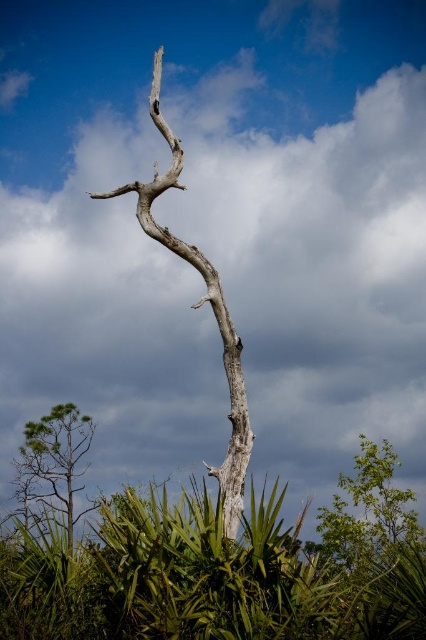
You are a photographer aiming to capture the gray textured branch at center in your shot. Your camera has a maximum focus range of 35 feet. Can you capture the branch clearly without moving closer?

The gray textured branch at center is 36.78 feet from the camera, which exceeds the maximum focus range of 35 feet. Therefore, the photographer cannot capture the branch clearly without moving closer.

You are standing in the middle of the scene and want to reach the gray textured branch at center. Which direction should you move to avoid the green leafy tree at lower left?

Since the gray textured branch at center is to the right of the green leafy tree at lower left, you should move to the right to avoid the green leafy tree at lower left and reach the gray textured branch at center.